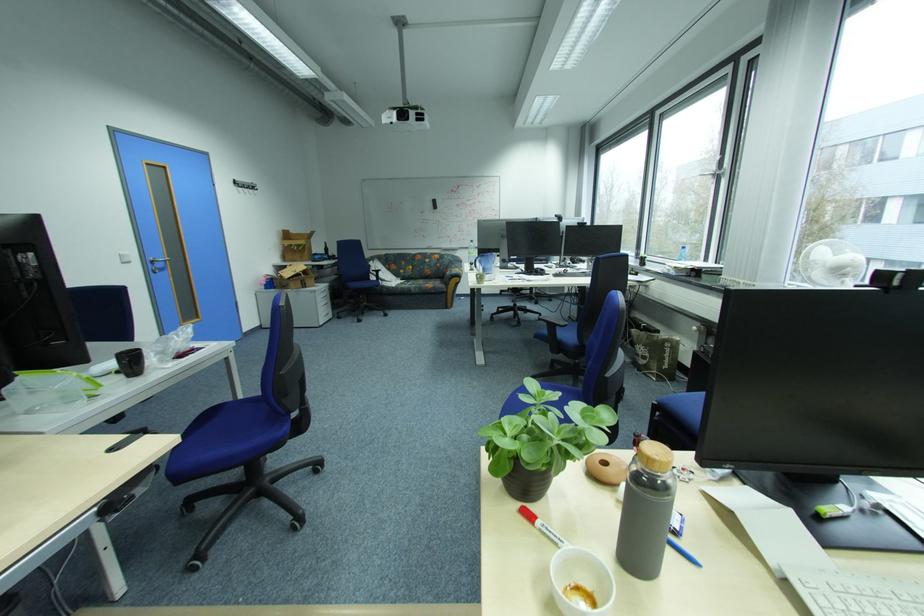
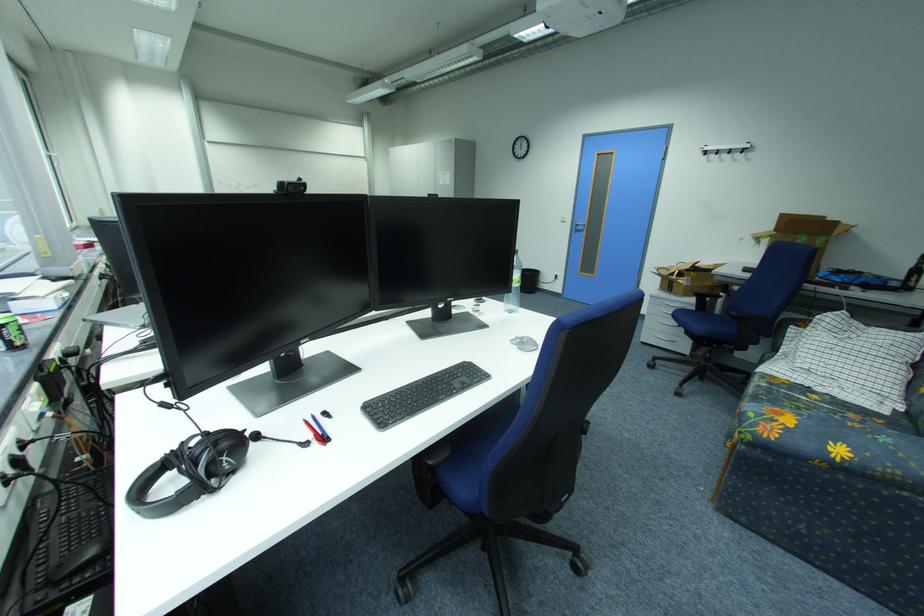
In the second image, find the point that corresponds to point 139,264 in the first image.

(574, 223)